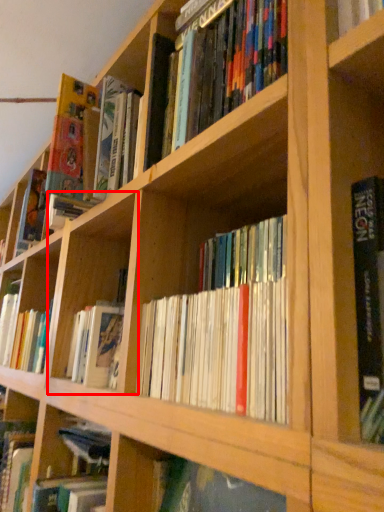
Question: From the image, what is the correct spatial relationship of cabinet (annotated by the red box) in relation to shelf?

Choices:
 (A) right
 (B) left

Answer: (B)